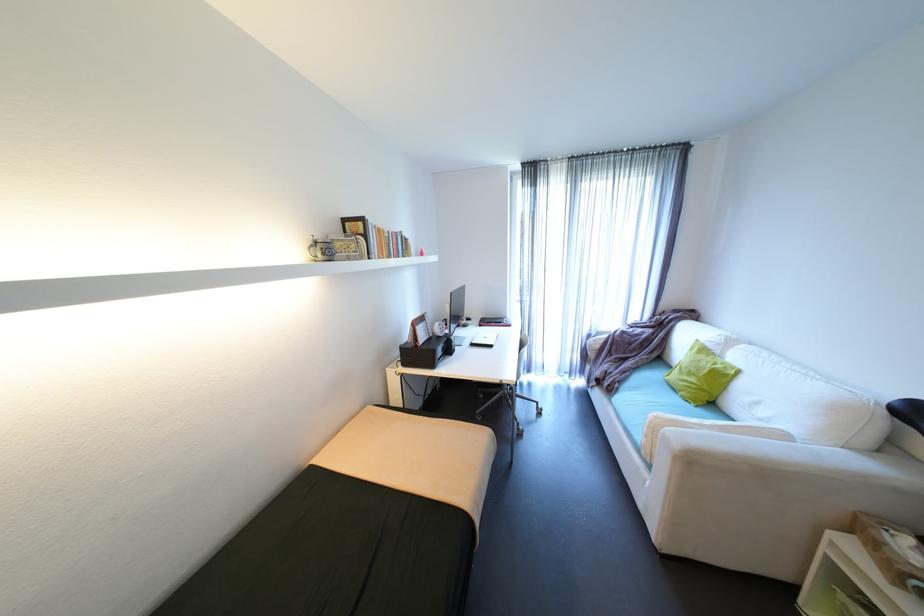
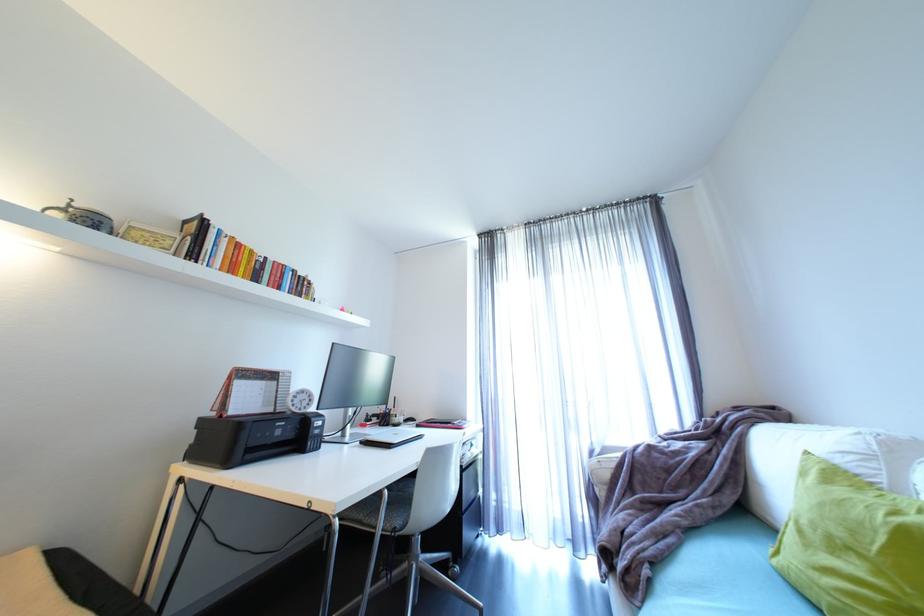
The point at (x=508, y=323) is marked in the first image. Where is the corresponding point in the second image?

(457, 424)